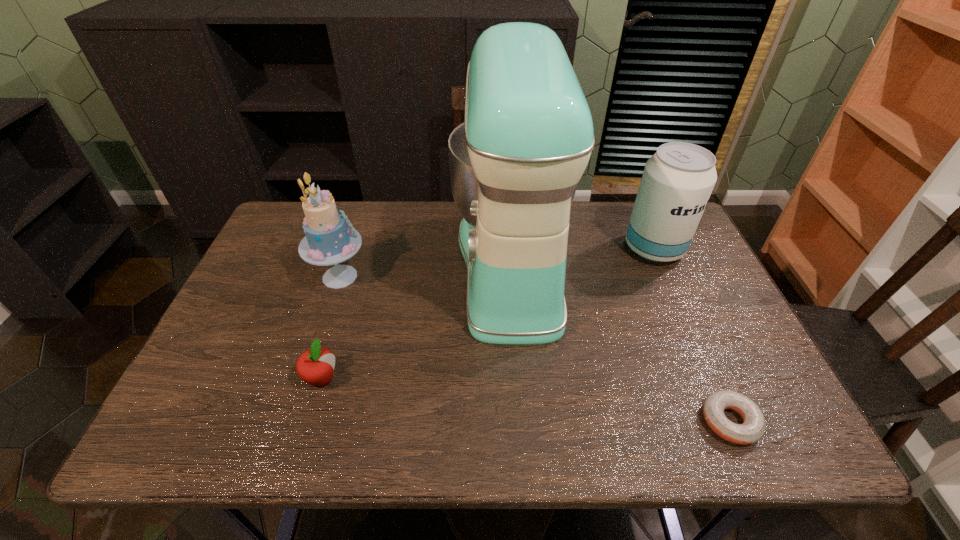
Where is `object that is at the far right corner`? Image resolution: width=960 pixels, height=540 pixels. object that is at the far right corner is located at coordinates (677, 181).

Locate an element on the screen. The width and height of the screenshot is (960, 540). object that is at the near right corner is located at coordinates (752, 430).

In the image, there is a desktop. What are the coordinates of `blank space at the far edge` in the screenshot? It's located at (611, 245).

At what (x,y) coordinates should I click in order to perform the action: click on free space at the near edge. Please return your answer as a coordinate pair (x, y). The height and width of the screenshot is (540, 960). Looking at the image, I should click on (388, 418).

Where is `vacant space at the left edge of the desktop`? vacant space at the left edge of the desktop is located at coordinates (252, 349).

This screenshot has height=540, width=960. Identify the location of vacant space at the right edge of the desktop. (708, 284).

In the image, there is a desktop. Where is `free region at the far left corner`? free region at the far left corner is located at coordinates (289, 217).

Image resolution: width=960 pixels, height=540 pixels. I want to click on vacant space at the near left corner of the desktop, so click(204, 414).

Identify the location of vacant space at the near right corner of the desktop. The image size is (960, 540). (783, 432).

Locate an element on the screen. The width and height of the screenshot is (960, 540). free space between the mixer and the apple is located at coordinates point(417,322).